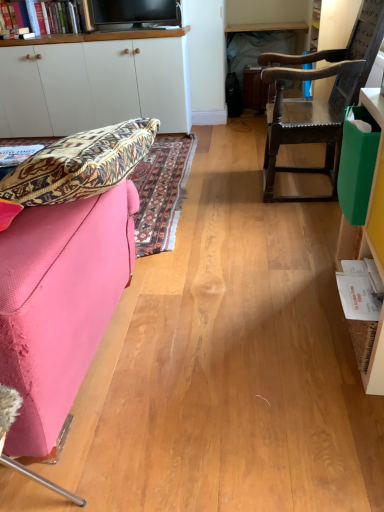
At what (x,y) coordinates should I click in order to perform the action: click on matte paper book at left, which appears as the second book when viewed from the front. Please return your answer as a coordinate pair (x, y). Looking at the image, I should click on (17, 154).

What do you see at coordinates (66, 273) in the screenshot? I see `pink fabric couch at left` at bounding box center [66, 273].

What do you see at coordinates (95, 82) in the screenshot?
I see `white matte cabinet at upper left, which ranks as the 1th cabinetry in back-to-front order` at bounding box center [95, 82].

Identify the location of dark brown wooden chair at right. Image resolution: width=384 pixels, height=512 pixels. (319, 103).

Can you tell me how much dark brown wooden chair at right and matte paper book at left, placed as the second book when sorted from right to left, differ in facing direction?

The angle between the facing direction of dark brown wooden chair at right and the facing direction of matte paper book at left, placed as the second book when sorted from right to left, is 84.5 degrees.

Identify the location of the 2nd book to the left of the dark brown wooden chair at right, starting your count from the anchor. The width and height of the screenshot is (384, 512). (17, 154).

Does dark brown wooden chair at right have a greater width compared to matte paper book at left, marked as the first book in a top-to-bottom arrangement?

Yes, dark brown wooden chair at right is wider than matte paper book at left, marked as the first book in a top-to-bottom arrangement.

Is dark brown wooden chair at right with matte paper book at left, which is counted as the 1th book, starting from the back?

No, dark brown wooden chair at right is not touching matte paper book at left, which is counted as the 1th book, starting from the back.

Where is `studio couch below the black glossy tv at upper center (from the image's perspective)`? This screenshot has height=512, width=384. studio couch below the black glossy tv at upper center (from the image's perspective) is located at coordinates (66, 273).

Would you consider black glossy tv at upper center to be distant from pink fabric couch at left?

Indeed, black glossy tv at upper center is not near pink fabric couch at left.

Which is less distant, (113, 29) or (57, 350)?

Point (113, 29) is farther from the camera than point (57, 350).

Considering the points (101, 135) and (35, 144), which point is in front, point (101, 135) or point (35, 144)?

The point (101, 135) is in front.

How far apart are pink fabric couch at left and matte paper book at left, the 2th book positioned from the bottom?

pink fabric couch at left is 26.46 inches from matte paper book at left, the 2th book positioned from the bottom.

Is pink fabric couch at left oriented towards matte paper book at left, which appears as the second book when viewed from the front?

Yes, pink fabric couch at left is aimed at matte paper book at left, which appears as the second book when viewed from the front.

Is pink fabric couch at left next to matte paper book at left, which is the first book from left to right, and touching it?

pink fabric couch at left and matte paper book at left, which is the first book from left to right, are clearly separated.

Considering the sizes of objects white matte cabinet at upper left, marked as the 1th cabinetry in a top-to-bottom arrangement, and black glossy tv at upper center in the image provided, who is shorter, white matte cabinet at upper left, marked as the 1th cabinetry in a top-to-bottom arrangement, or black glossy tv at upper center?

With less height is black glossy tv at upper center.

From the picture: From a real-world perspective, is white matte cabinet at upper left, marked as the 1th cabinetry in a top-to-bottom arrangement, above or below black glossy tv at upper center?

From a real-world perspective, white matte cabinet at upper left, marked as the 1th cabinetry in a top-to-bottom arrangement, is physically below black glossy tv at upper center.

Which object is thinner, white matte cabinet at upper left, the second cabinetry when ordered from front to back, or black glossy tv at upper center?

black glossy tv at upper center is thinner.

Does white matte cabinet at upper left, the 2th cabinetry in the bottom-to-top sequence, have a larger size compared to green plastic bag at right, which ranks as the first cabinetry in bottom-to-top order?

Yes.

Where is `cabinetry positioned vertically above the green plastic bag at right, which appears as the second cabinetry when viewed from the back (from a real-world perspective)`? cabinetry positioned vertically above the green plastic bag at right, which appears as the second cabinetry when viewed from the back (from a real-world perspective) is located at coordinates pyautogui.click(x=95, y=82).

Between white matte cabinet at upper left, the second cabinetry when ordered from front to back, and green plastic bag at right, the 1th cabinetry in the front-to-back sequence, which one is positioned behind?

white matte cabinet at upper left, the second cabinetry when ordered from front to back, is more distant.

Which object is wider, white matte cabinet at upper left, which ranks as the 1th cabinetry in back-to-front order, or green plastic bag at right, the 2th cabinetry when ordered from left to right?

white matte cabinet at upper left, which ranks as the 1th cabinetry in back-to-front order.

Which object is further away from the camera taking this photo, dark brown wooden chair at right or white paper book at right, which is the 1th book in front-to-back order?

Positioned behind is dark brown wooden chair at right.

From a real-world perspective, which object rests below the other?

From a 3D spatial view, white paper book at right, which is the first book in bottom-to-top order, is below.

How far apart are dark brown wooden chair at right and white paper book at right, which appears as the 2th book when viewed from the top?

1.14 meters.

Between black glossy tv at upper center and dark brown wooden chair at right, which one has less height?

black glossy tv at upper center.

Is black glossy tv at upper center in front of or behind dark brown wooden chair at right in the image?

black glossy tv at upper center is behind dark brown wooden chair at right.

Is black glossy tv at upper center wider or thinner than dark brown wooden chair at right?

Considering their sizes, black glossy tv at upper center looks slimmer than dark brown wooden chair at right.

This screenshot has height=512, width=384. Find the location of `chair below the black glossy tv at upper center (from a real-world perspective)`. chair below the black glossy tv at upper center (from a real-world perspective) is located at coordinates (319, 103).

From a real-world perspective, which book is the 1st one underneath the dark brown wooden chair at right? Please provide its 2D coordinates.

[(17, 154)]

I want to click on studio couch that appears below the black glossy tv at upper center (from the image's perspective), so click(x=66, y=273).

Estimate the real-world distances between objects in this image. Which object is further from white matte cabinet at upper left, which is the 1th cabinetry from left to right, white paper book at right, which is counted as the first book, starting from the right, or pink fabric couch at left?

white paper book at right, which is counted as the first book, starting from the right, is further to white matte cabinet at upper left, which is the 1th cabinetry from left to right.

Which object lies nearer to the anchor point matte paper book at left, marked as the first book in a top-to-bottom arrangement, pink fabric couch at left or white paper book at right, which appears as the 2th book when viewed from the top?

Based on the image, pink fabric couch at left appears to be nearer to matte paper book at left, marked as the first book in a top-to-bottom arrangement.

Estimate the real-world distances between objects in this image. Which object is further from white paper book at right, which appears as the 2th book when viewed from the back, white matte cabinet at upper left, which is the 2th cabinetry from right to left, or matte paper book at left, which is counted as the 1th book, starting from the back?

white matte cabinet at upper left, which is the 2th cabinetry from right to left.

Which object lies further to the anchor point white matte cabinet at upper left, which is the 1th cabinetry from left to right, green plastic bag at right, the 1th cabinetry in the front-to-back sequence, or white paper book at right, which appears as the 2th book when viewed from the top?

white paper book at right, which appears as the 2th book when viewed from the top, is further to white matte cabinet at upper left, which is the 1th cabinetry from left to right.

From the image, which object appears to be nearer to green plastic bag at right, the 1th cabinetry in the front-to-back sequence, matte paper book at left, the 2th book positioned from the bottom, or white matte cabinet at upper left, the second cabinetry when ordered from front to back?

Among the two, matte paper book at left, the 2th book positioned from the bottom, is located nearer to green plastic bag at right, the 1th cabinetry in the front-to-back sequence.

Considering their positions, is white paper book at right, which is the 1th book in front-to-back order, positioned further to green plastic bag at right, which ranks as the first cabinetry in bottom-to-top order, than dark brown wooden chair at right?

dark brown wooden chair at right.

Estimate the real-world distances between objects in this image. Which object is closer to matte paper book at left, which appears as the second book when viewed from the front, pink fabric couch at left or white matte cabinet at upper left, marked as the 1th cabinetry in a top-to-bottom arrangement?

pink fabric couch at left is closer to matte paper book at left, which appears as the second book when viewed from the front.

From the image, which object appears to be nearer to matte paper book at left, which is the first book from left to right, dark brown wooden chair at right or green plastic bag at right, the 2th cabinetry when ordered from left to right?

green plastic bag at right, the 2th cabinetry when ordered from left to right.

What are the coordinates of `studio couch located between matte paper book at left, which is the first book from left to right, and dark brown wooden chair at right in the left-right direction` in the screenshot? It's located at (66, 273).

You are a GUI agent. You are given a task and a screenshot of the screen. Output one action in this format:
    pyautogui.click(x=<x>, y=<y>)
    Task: Click on the chair between pink fabric couch at left and white matte cabinet at upper left, marked as the 1th cabinetry in a top-to-bottom arrangement, in the front-back direction
    This screenshot has height=512, width=384.
    Given the screenshot: What is the action you would take?
    pyautogui.click(x=319, y=103)

Find the location of a particular element. The height and width of the screenshot is (512, 384). cabinetry positioned between green plastic bag at right, marked as the 2th cabinetry in a top-to-bottom arrangement, and black glossy tv at upper center from near to far is located at coordinates (95, 82).

The image size is (384, 512). I want to click on chair between white paper book at right, which ranks as the 2th book in left-to-right order, and black glossy tv at upper center in the front-back direction, so click(319, 103).